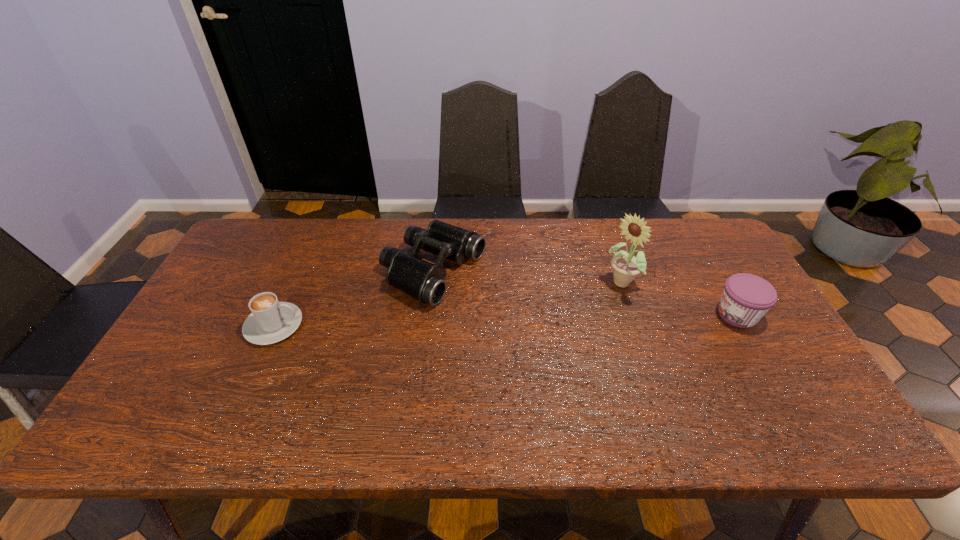
Image resolution: width=960 pixels, height=540 pixels. Identify the location of free space on the desktop that is between the leftmost object and the rightmost object and is positioned on the front-facing side of the second object from left to right. (549, 319).

Identify the location of vacant space on the desktop that is between the cappuccino and the rightmost object and is positioned on the front-facing side of the tallest object. (573, 319).